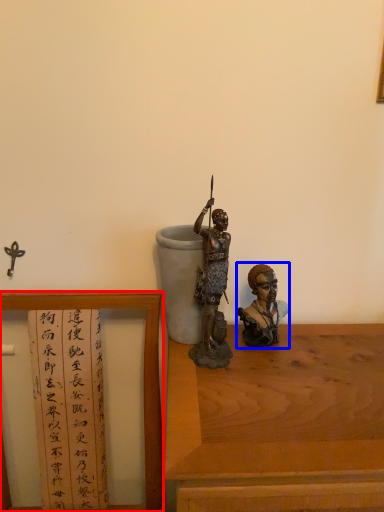
Question: Which of the following is the farthest to the observer, furniture (highlighted by a red box) or person (highlighted by a blue box)?

Choices:
 (A) furniture
 (B) person

Answer: (B)